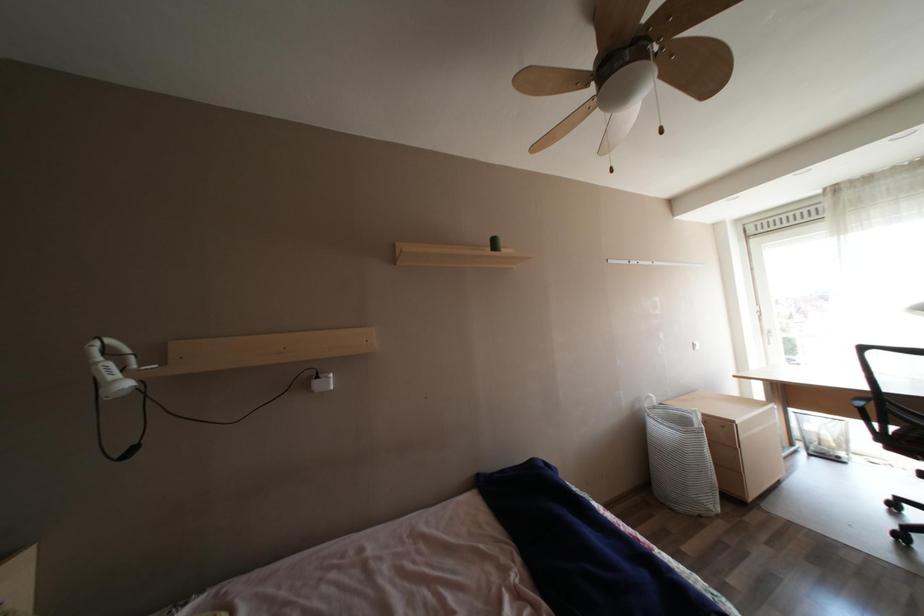
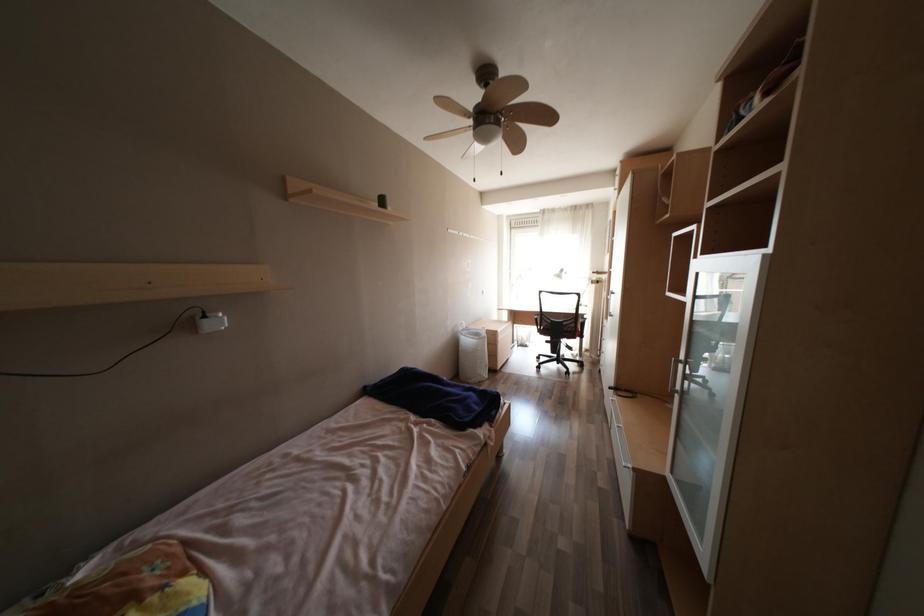
Question: The camera is either moving clockwise (left) or counter-clockwise (right) around the object. The first image is from the beginning of the video and the second image is from the end. Is the camera moving left or right when shooting the video?

Choices:
 (A) Left
 (B) Right

Answer: (A)